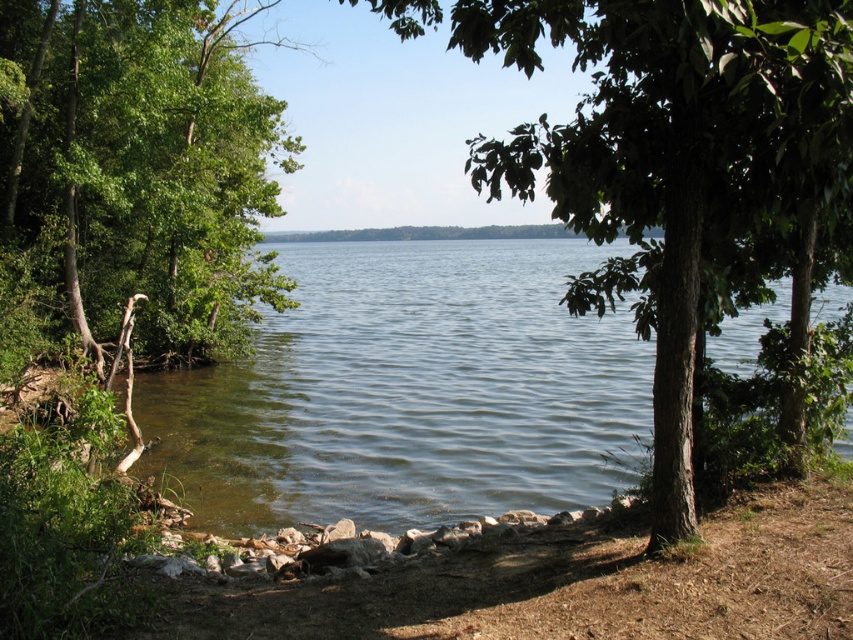
Is point (337, 445) less distant than point (514, 6)?

No, it is not.

Is clear water at center to the right of green rough bark tree at center from the viewer's perspective?

Incorrect, clear water at center is not on the right side of green rough bark tree at center.

Image resolution: width=853 pixels, height=640 pixels. In order to click on clear water at center in this screenshot , I will do `click(408, 392)`.

Locate an element on the screen. This screenshot has height=640, width=853. clear water at center is located at coordinates [x=408, y=392].

In the scene shown: Who is positioned more to the right, green rough bark tree at center or green leafy tree at left?

From the viewer's perspective, green rough bark tree at center appears more on the right side.

Which is in front, point (556, 196) or point (126, 102)?

Point (556, 196)

Between point (662, 442) and point (228, 20), which one is positioned in front?

Point (662, 442) is in front.

This screenshot has height=640, width=853. I want to click on green rough bark tree at center, so click(x=672, y=157).

Between green rough bark tree at center and smooth dirt shoreline at lower center, which one appears on the left side from the viewer's perspective?

green rough bark tree at center is more to the left.

Does point (801, 172) come closer to viewer compared to point (698, 593)?

That is True.

What do you see at coordinates (672, 157) in the screenshot?
I see `green rough bark tree at center` at bounding box center [672, 157].

Locate an element on the screen. green rough bark tree at center is located at coordinates (672, 157).